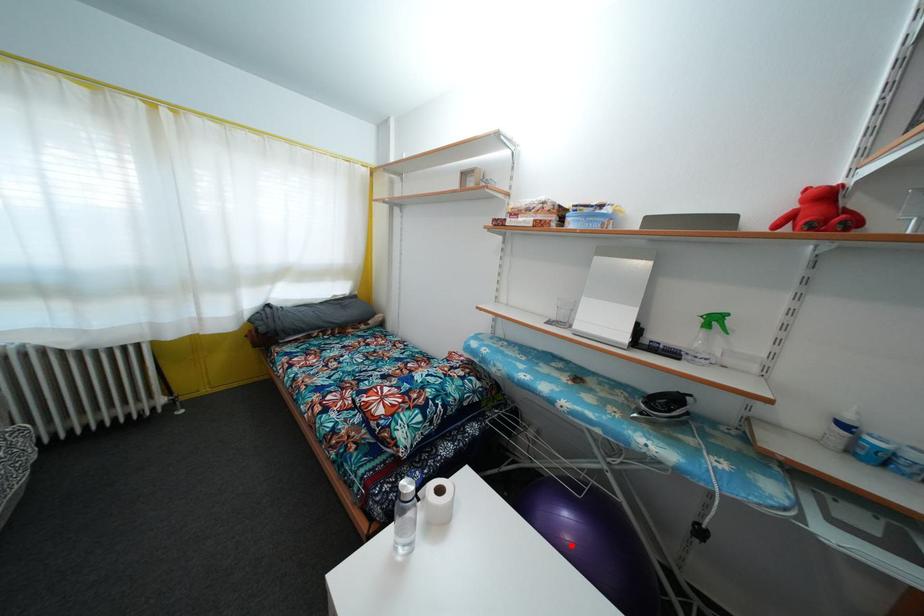
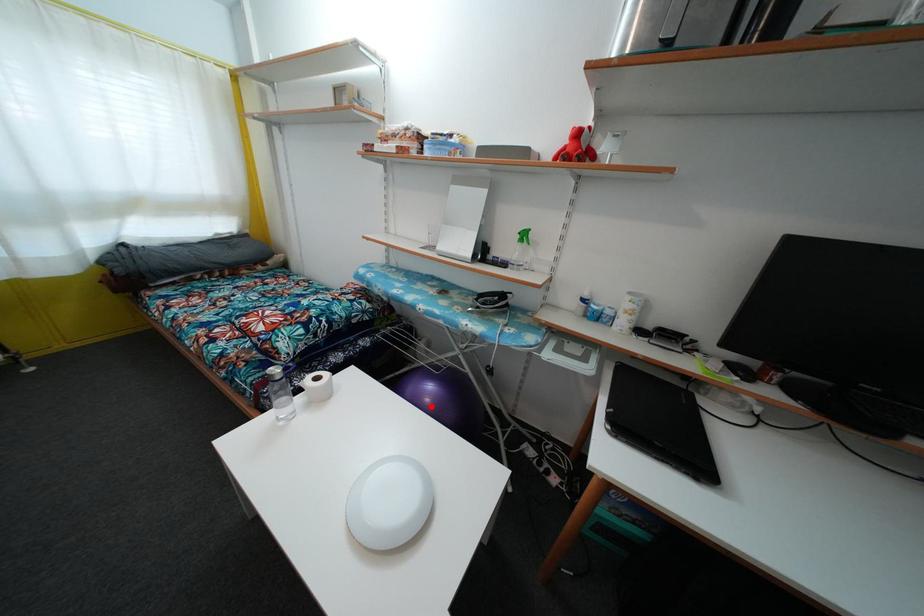
I am providing you with two images of the same scene from different viewpoints. A red point is marked on the first image and another point is marked on the second image. Do the highlighted points in image1 and image2 indicate the same real-world spot?

Yes